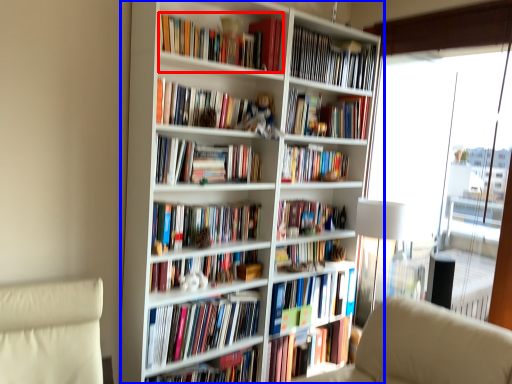
Question: Which object appears closest to the camera in this image, book (highlighted by a red box) or bookcase (highlighted by a blue box)?

Choices:
 (A) book
 (B) bookcase

Answer: (B)